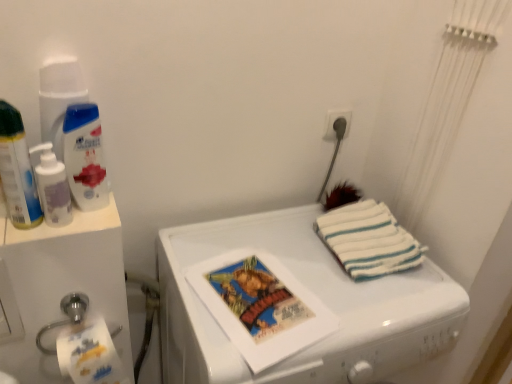
Identify the location of vacant area on top of white glossy washing machine at center (from a real-world perspective). (290, 268).